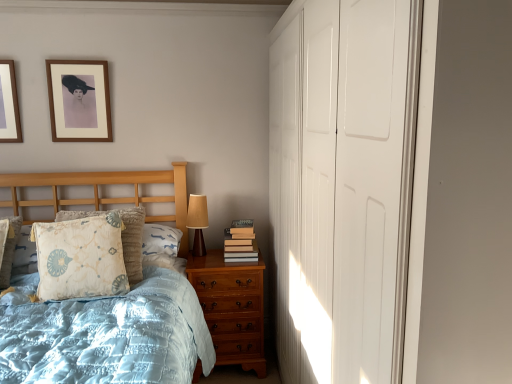
Question: Considering the relative sizes of matte brown wood table lamp at right and light brown wood chest of drawers at lower right in the image provided, is matte brown wood table lamp at right taller than light brown wood chest of drawers at lower right?

Choices:
 (A) yes
 (B) no

Answer: (B)

Question: Can you confirm if matte brown wood table lamp at right is bigger than light brown wood chest of drawers at lower right?

Choices:
 (A) no
 (B) yes

Answer: (A)

Question: Would you say matte brown wood table lamp at right contains light brown wood chest of drawers at lower right?

Choices:
 (A) no
 (B) yes

Answer: (A)

Question: From a real-world perspective, is matte brown wood table lamp at right under light brown wood chest of drawers at lower right?

Choices:
 (A) no
 (B) yes

Answer: (A)

Question: Is matte brown wood table lamp at right next to light brown wood chest of drawers at lower right?

Choices:
 (A) no
 (B) yes

Answer: (A)

Question: Does matte brown wood table lamp at right have a greater width compared to light brown wood chest of drawers at lower right?

Choices:
 (A) no
 (B) yes

Answer: (A)

Question: Is floral-patterned fabric pillow at left far from matte brown wood table lamp at right?

Choices:
 (A) no
 (B) yes

Answer: (A)

Question: Can you confirm if floral-patterned fabric pillow at left is wider than matte brown wood table lamp at right?

Choices:
 (A) no
 (B) yes

Answer: (B)

Question: Does floral-patterned fabric pillow at left appear on the right side of matte brown wood table lamp at right?

Choices:
 (A) yes
 (B) no

Answer: (B)

Question: From the image's perspective, does floral-patterned fabric pillow at left appear higher than matte brown wood table lamp at right?

Choices:
 (A) yes
 (B) no

Answer: (B)

Question: Does floral-patterned fabric pillow at left appear on the left side of matte brown wood table lamp at right?

Choices:
 (A) no
 (B) yes

Answer: (B)

Question: Considering the relative sizes of floral-patterned fabric pillow at left and matte brown wood table lamp at right in the image provided, is floral-patterned fabric pillow at left smaller than matte brown wood table lamp at right?

Choices:
 (A) no
 (B) yes

Answer: (A)

Question: Considering the relative positions of wooden picture frame at upper left, arranged as the 2th picture frame when viewed from the left, and white glossy closet doors at right in the image provided, is wooden picture frame at upper left, arranged as the 2th picture frame when viewed from the left, behind white glossy closet doors at right?

Choices:
 (A) yes
 (B) no

Answer: (A)